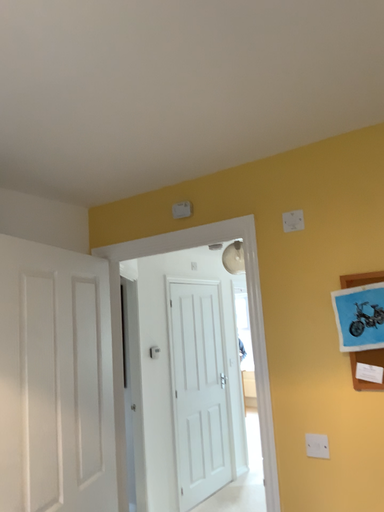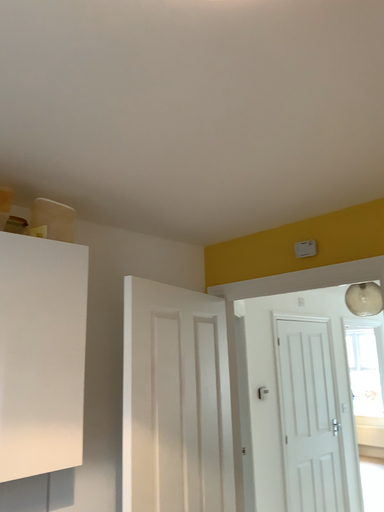
Question: How did the camera likely rotate when shooting the video?

Choices:
 (A) rotated right
 (B) rotated left

Answer: (B)